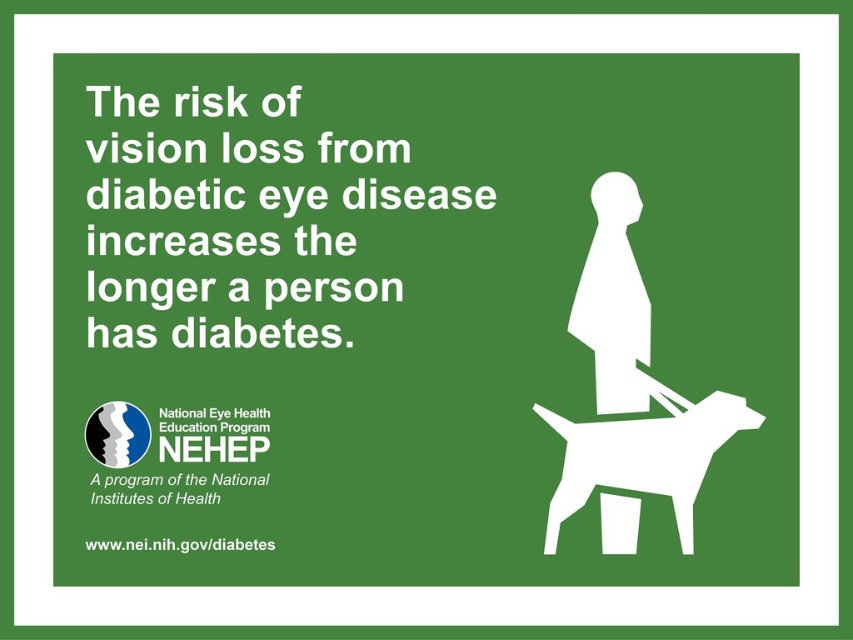
Question: Among these objects, which one is farthest from the camera?

Choices:
 (A) white matte figure at center
 (B) white matte dog at lower right

Answer: (A)

Question: Where is white matte dog at lower right located in relation to white matte figure at center in the image?

Choices:
 (A) left
 (B) right

Answer: (B)

Question: Which point is closer to the camera taking this photo?

Choices:
 (A) (682, 417)
 (B) (602, 193)

Answer: (A)

Question: Observing the image, what is the correct spatial positioning of white matte dog at lower right in reference to white matte figure at center?

Choices:
 (A) left
 (B) right

Answer: (B)

Question: Is the position of white matte dog at lower right more distant than that of white matte figure at center?

Choices:
 (A) no
 (B) yes

Answer: (A)